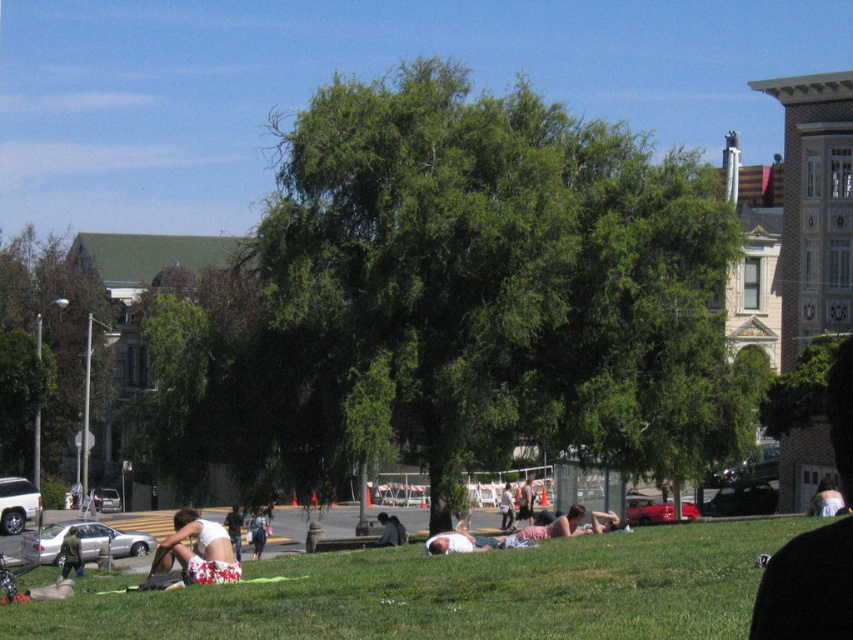
You are standing in the park and want to take a photo of both the tree and the buildings in the background. Which point, point [793,632] or point [207,572], should you focus on to ensure both the tree and buildings are in focus?

You should focus on point [793,632] because it is closer to the camera, ensuring both the tree and buildings will be in focus.

You are standing at the center of the park and want to find the green leafy tree at center. According to the coordinates provided, in which direction should you move to reach it?

The green leafy tree at center is located at coordinates point (457,301). Since you are already at the center of the park, you are already at the location of the green leafy tree at center.